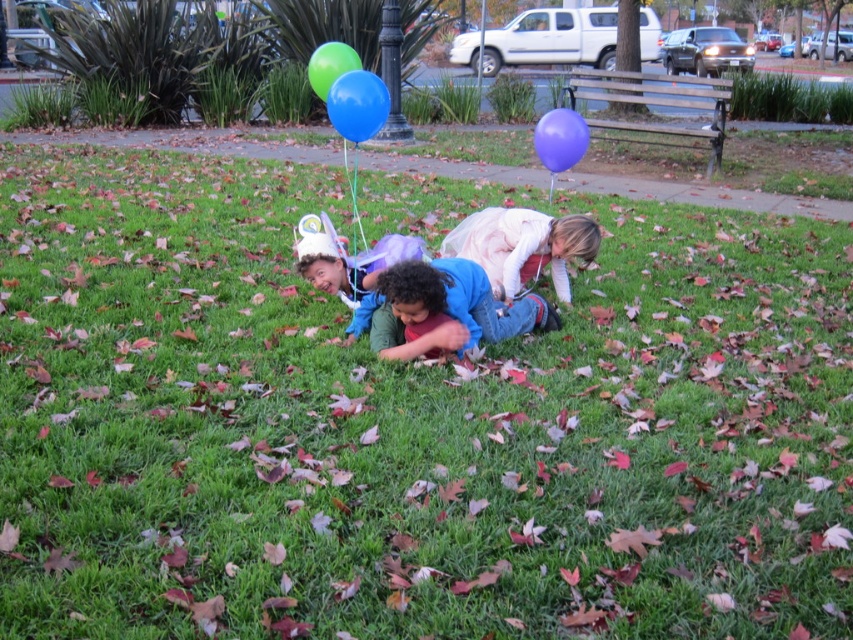
Question: Considering the real-world distances, which object is closest to the blue rubber balloon at center?

Choices:
 (A) matte purple balloon at upper right
 (B) light pink fabric dress at center
 (C) blue denim jeans at center
 (D) green rubber balloon at center

Answer: (D)

Question: Is blue rubber balloon at center smaller than green rubber balloon at center?

Choices:
 (A) yes
 (B) no

Answer: (B)

Question: Which of the following is the farthest from the observer?

Choices:
 (A) blue denim jeans at center
 (B) blue rubber balloon at center
 (C) light pink fabric dress at center

Answer: (B)

Question: Which point is closer to the camera?

Choices:
 (A) (331, 83)
 (B) (412, 284)
 (C) (554, 157)

Answer: (B)

Question: From the image, what is the correct spatial relationship of blue rubber balloon at center in relation to matte purple balloon at upper right?

Choices:
 (A) above
 (B) below

Answer: (A)

Question: Can you confirm if blue denim jeans at center is positioned above green rubber balloon at center?

Choices:
 (A) yes
 (B) no

Answer: (B)